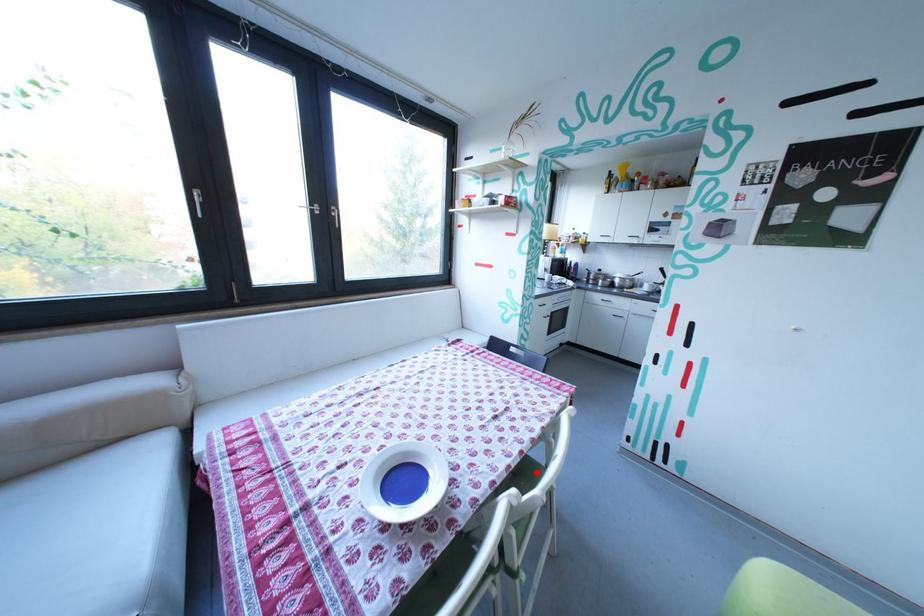
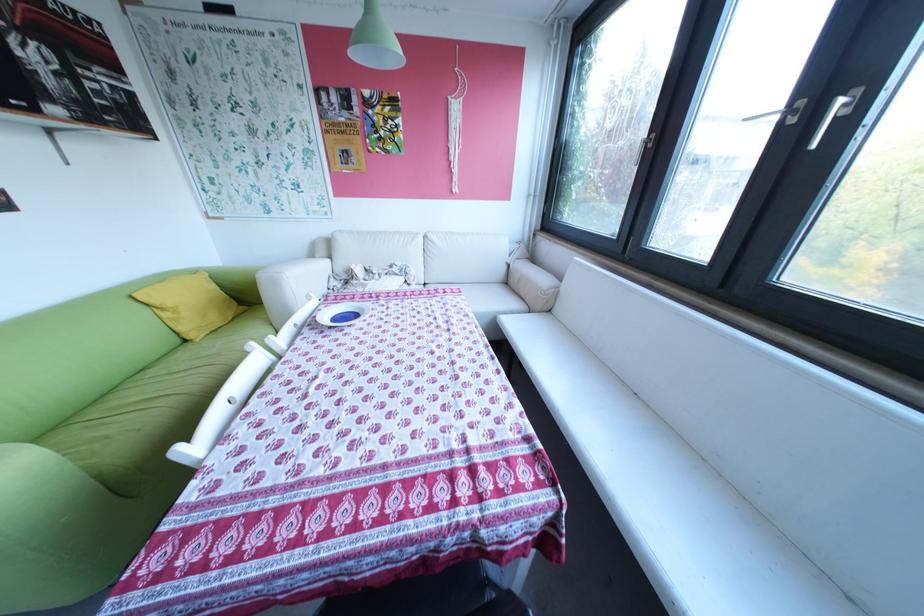
Question: I am providing you with two images of the same scene from different viewpoints. A red point is marked on the first image. Can you still see the location of the red point in image 2?

Choices:
 (A) Yes
 (B) No

Answer: (B)